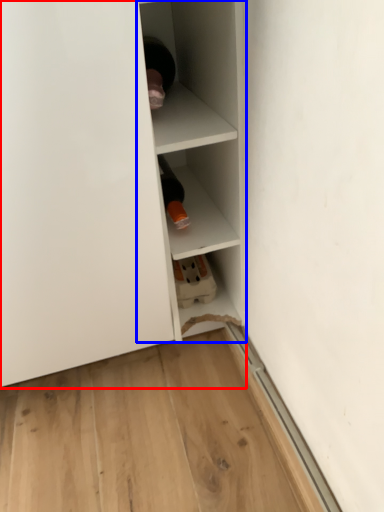
Question: Which object appears closest to the camera in this image, shelf (highlighted by a red box) or shelf (highlighted by a blue box)?

Choices:
 (A) shelf
 (B) shelf

Answer: (A)